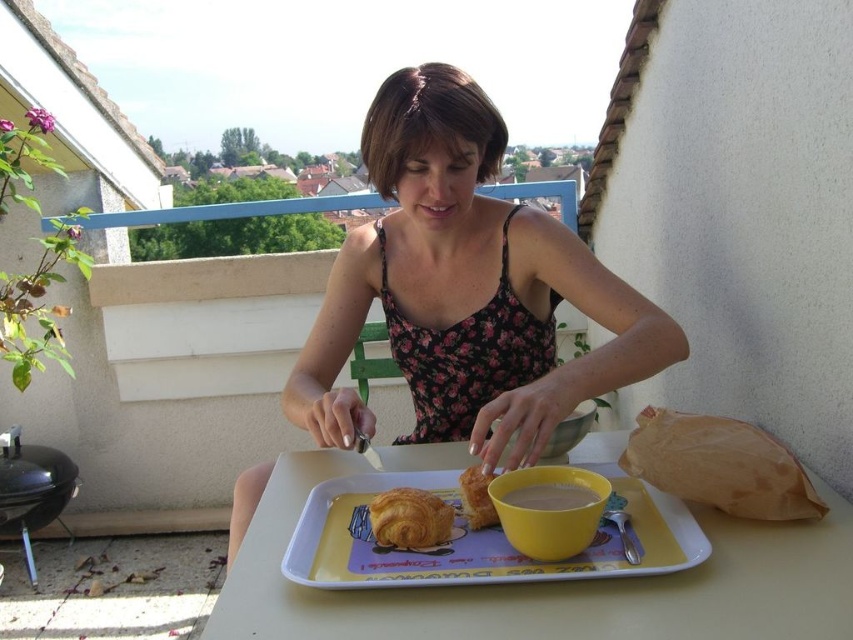
Between golden brown flaky croissant at center and golden flaky croissant at center, which one is positioned higher?

golden flaky croissant at center is higher up.

Who is positioned more to the left, golden brown flaky croissant at center or golden flaky croissant at center?

golden brown flaky croissant at center is more to the left.

At what (x,y) coordinates should I click in order to perform the action: click on golden brown flaky croissant at center. Please return your answer as a coordinate pair (x, y). This screenshot has height=640, width=853. Looking at the image, I should click on (410, 518).

Can you confirm if floral fabric dress at center is positioned below golden brown flaky croissant at center?

Actually, floral fabric dress at center is above golden brown flaky croissant at center.

I want to click on floral fabric dress at center, so click(465, 289).

Is point (366, 122) positioned before point (389, 509)?

That is False.

Locate an element on the screen. floral fabric dress at center is located at coordinates (465, 289).

Which is above, floral fabric dress at center or yellow plastic tray at center?

floral fabric dress at center

What do you see at coordinates (465, 289) in the screenshot? I see `floral fabric dress at center` at bounding box center [465, 289].

Where is `floral fabric dress at center`? This screenshot has height=640, width=853. floral fabric dress at center is located at coordinates (465, 289).